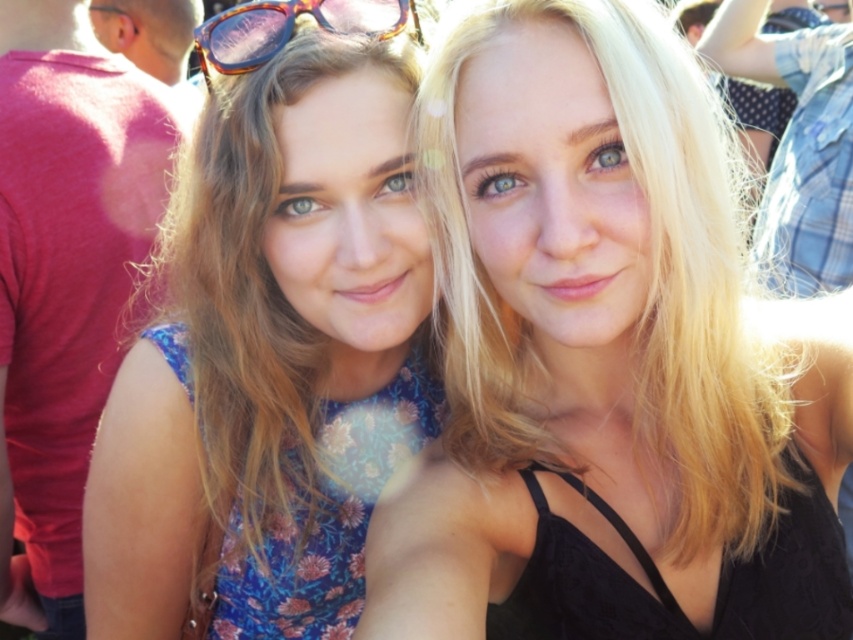
Question: Among these objects, which one is nearest to the camera?

Choices:
 (A) floral fabric dress at left
 (B) tortoiseshell plastic goggles at upper center
 (C) blonde hair at center

Answer: (C)

Question: Which object appears farthest from the camera in this image?

Choices:
 (A) blonde hair at center
 (B) tortoiseshell plastic goggles at upper center

Answer: (B)

Question: Can you confirm if floral fabric dress at left is bigger than tortoiseshell plastic goggles at upper center?

Choices:
 (A) yes
 (B) no

Answer: (A)

Question: Which object is closer to the camera taking this photo?

Choices:
 (A) tortoiseshell plastic goggles at upper center
 (B) floral fabric dress at left
 (C) blonde hair at center

Answer: (C)

Question: Can you confirm if blonde hair at center is bigger than tortoiseshell plastic goggles at upper center?

Choices:
 (A) yes
 (B) no

Answer: (A)

Question: Is floral fabric dress at left bigger than tortoiseshell plastic goggles at upper center?

Choices:
 (A) no
 (B) yes

Answer: (B)